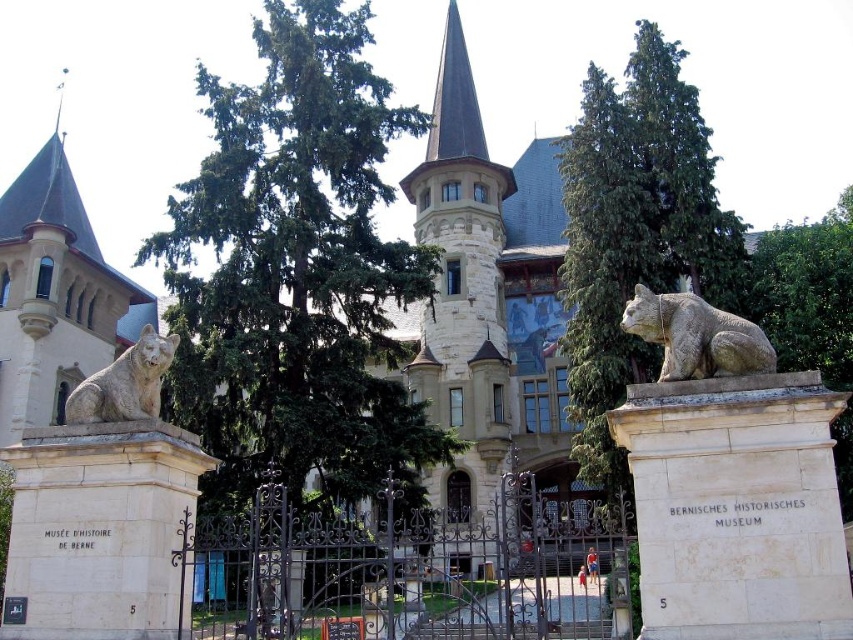
You are standing at the entrance of the Bernisches Historisches Museum and want to take a photo of the point labeled as point (643, 289). If your camera has a maximum zoom range of 25 meters, will you be able to capture the point clearly in your photo?

The point labeled as point (643, 289) is 32.01 meters away from the camera. Since the camera can only zoom up to 25 meters, it will not be able to capture the point clearly within that range.

You are a visitor standing at the entrance of the Bernisches Historisches Museum. You notice a green leafy tree at upper right and a shiny dark gray spire at center. If you want to walk directly from the tree to the spire, would you need to walk more than 40 meters?

The distance between the green leafy tree at upper right and the shiny dark gray spire at center is 42.99 meters, so yes, you would need to walk more than 40 meters to reach the spire from the tree.

You are standing at the entrance of the Bernisches Historisches Museum and want to take a photo of the point marked at coordinates (831, 243) on your camera screen. If your camera has a zoom range that can focus up to 70 meters, will you be able to capture the point clearly in your photo?

The point at coordinates (831, 243) is 67.04 meters away from you. Since your camera can focus up to 70 meters, it is within the zoom range, so yes, you can capture the point clearly.